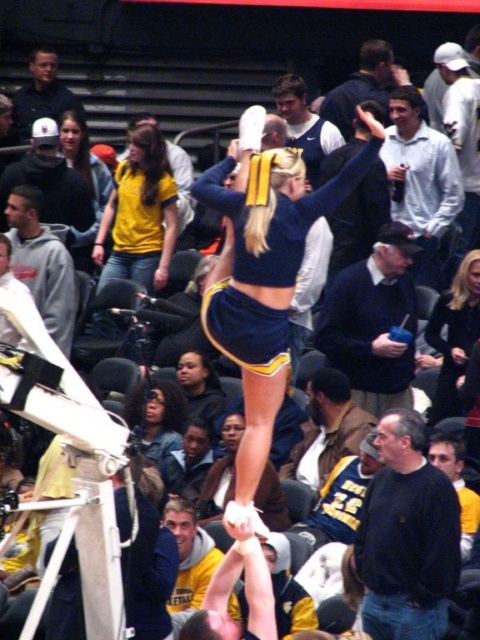
You are a photographer at the event and want to capture a clear photo of both the yellow matte shirt at center and the dark blue hoodie at center. Which one should you focus on to ensure it appears larger in the photo?

The yellow matte shirt at center is bigger than the dark blue hoodie at center, so focusing on the yellow matte shirt at center will ensure it appears larger in the photo.